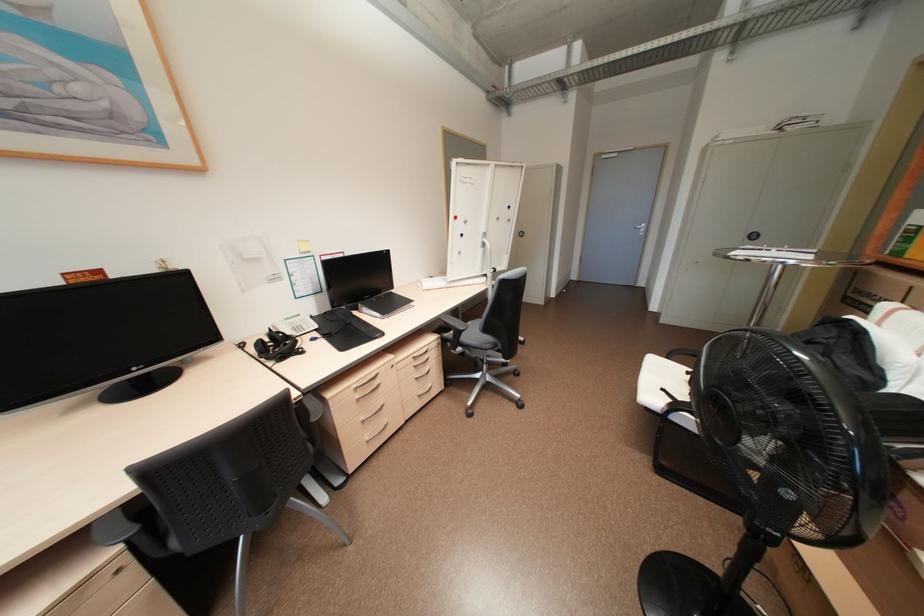
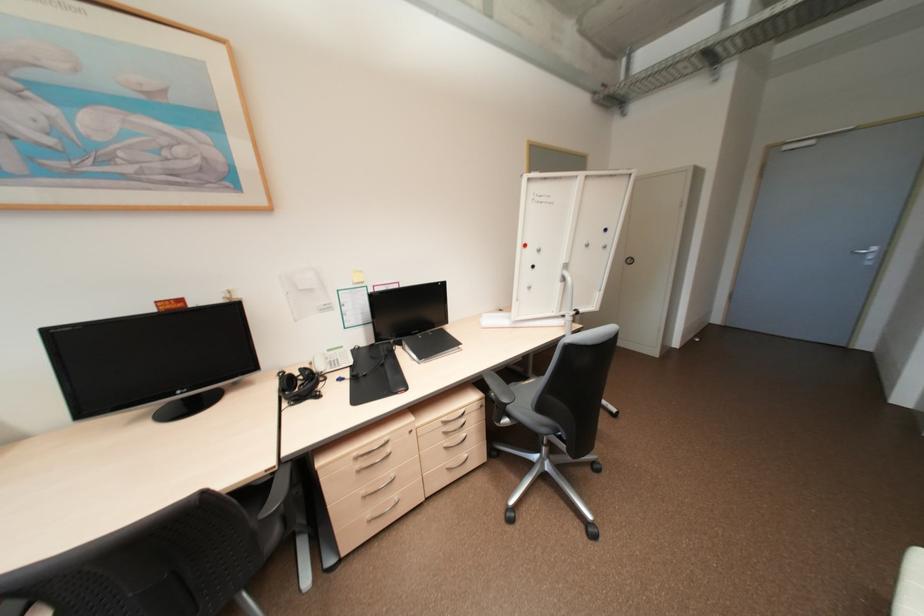
Locate, in the second image, the point that corresponds to point 372,438 in the first image.

(374, 516)